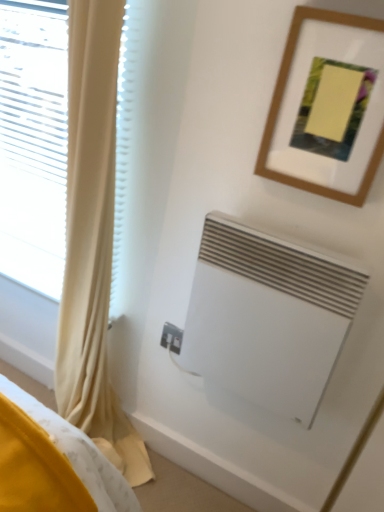
Question: Is white matte air conditioning at lower right inside or outside of yellow fabric curtain at left?

Choices:
 (A) outside
 (B) inside

Answer: (A)

Question: Considering their positions, is white matte air conditioning at lower right located in front of or behind yellow fabric curtain at left?

Choices:
 (A) front
 (B) behind

Answer: (B)

Question: Which is farther from the wooden picture frame at upper right?

Choices:
 (A) white plastic electric outlet at lower center
 (B) white matte air conditioning at lower right
 (C) yellow fabric curtain at left

Answer: (A)

Question: Which object is the closest to the white plastic electric outlet at lower center?

Choices:
 (A) white matte air conditioning at lower right
 (B) yellow fabric curtain at left
 (C) wooden picture frame at upper right

Answer: (A)